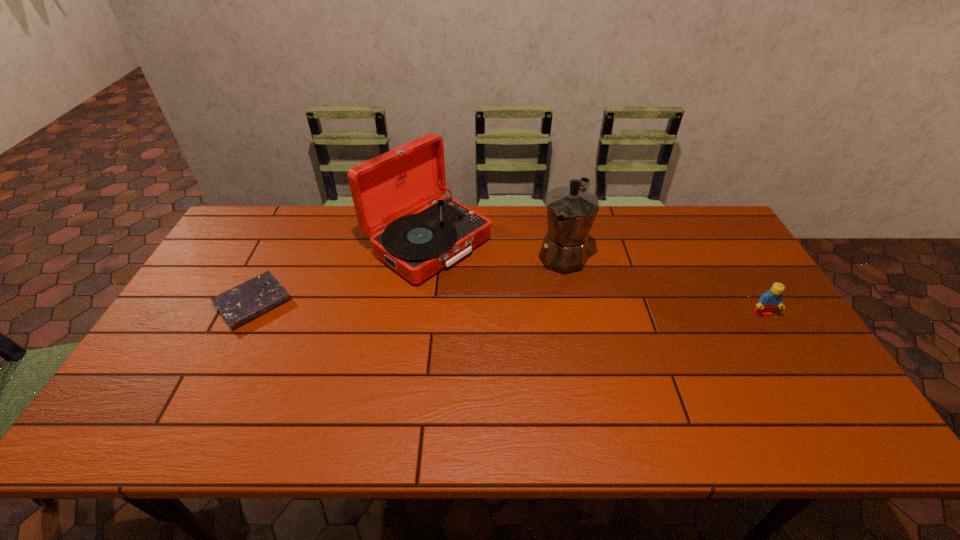
Locate an element on the screen. Image resolution: width=960 pixels, height=540 pixels. diary is located at coordinates (239, 305).

Image resolution: width=960 pixels, height=540 pixels. I want to click on the leftmost object, so click(x=239, y=305).

Find the location of a particular element. Lego is located at coordinates [x=768, y=301].

Identify the location of the rightmost object. (x=768, y=301).

This screenshot has width=960, height=540. I want to click on the second object from right to left, so click(x=571, y=211).

This screenshot has height=540, width=960. In order to click on the second object from left to right in this screenshot , I will do `click(386, 189)`.

The width and height of the screenshot is (960, 540). What are the coordinates of `free space located on the back of the leftmost object` in the screenshot? It's located at (301, 207).

Where is `free space located 0.140m on the face of the rightmost object`? This screenshot has height=540, width=960. free space located 0.140m on the face of the rightmost object is located at coordinates (791, 361).

What are the coordinates of `blank space located 0.300m on the pouring side of the third object from left to right` in the screenshot? It's located at (514, 348).

You are a GUI agent. You are given a task and a screenshot of the screen. Output one action in this format:
    pyautogui.click(x=<x>, y=<y>)
    Task: Click on the free space located on the pouring side of the third object from left to right
    This screenshot has height=540, width=960.
    Given the screenshot: What is the action you would take?
    pyautogui.click(x=535, y=312)